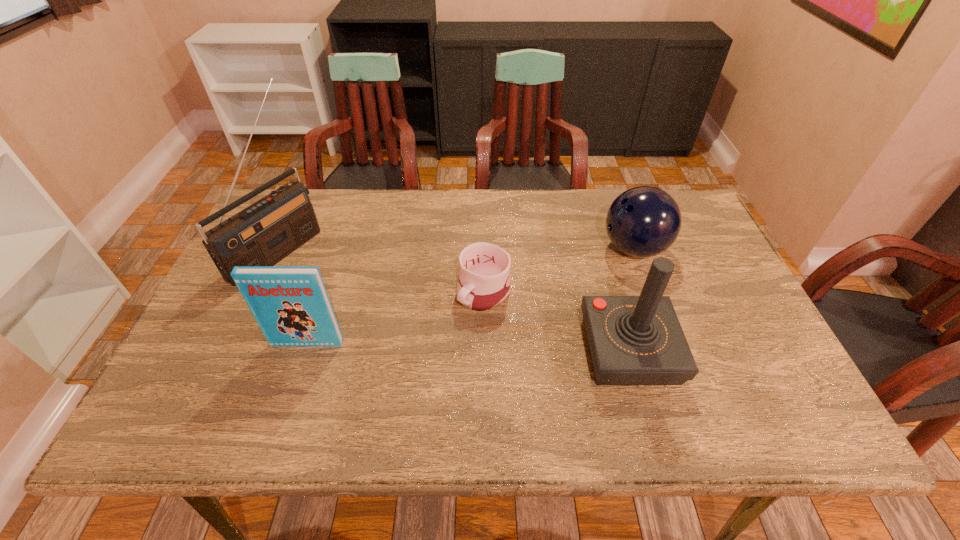
Where is `book`? The width and height of the screenshot is (960, 540). book is located at coordinates (290, 304).

Image resolution: width=960 pixels, height=540 pixels. What are the coordinates of `joystick` in the screenshot? It's located at (633, 340).

This screenshot has height=540, width=960. Find the location of `the tallest object`. the tallest object is located at coordinates (264, 233).

Locate an element on the screen. bowling ball is located at coordinates (644, 221).

In order to click on mug in this screenshot , I will do `click(484, 281)`.

Identify the location of the third object from right to left. (484, 281).

This screenshot has width=960, height=540. Find the location of `free space located 0.260m on the front-facing side of the radio receiver`. free space located 0.260m on the front-facing side of the radio receiver is located at coordinates (370, 308).

Find the location of `free region located on the front-facing side of the radio receiver`. free region located on the front-facing side of the radio receiver is located at coordinates (323, 282).

Locate an element on the screen. free space located on the front-facing side of the radio receiver is located at coordinates (321, 280).

The image size is (960, 540). In order to click on vacant area situated 0.220m on the surface of the fourth tallest object near the finger holes in this screenshot , I will do `click(546, 291)`.